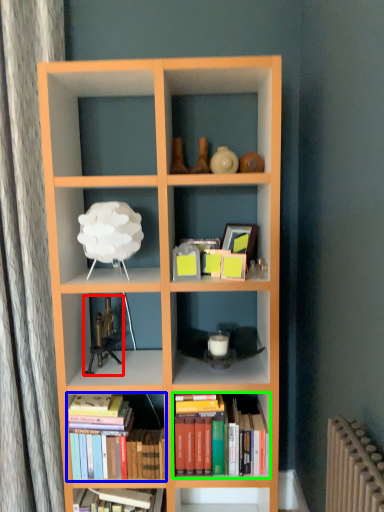
Question: Based on their relative distances, which object is nearer to toy (highlighted by a red box)? Choose from book (highlighted by a blue box) and book (highlighted by a green box).

Choices:
 (A) book
 (B) book

Answer: (A)